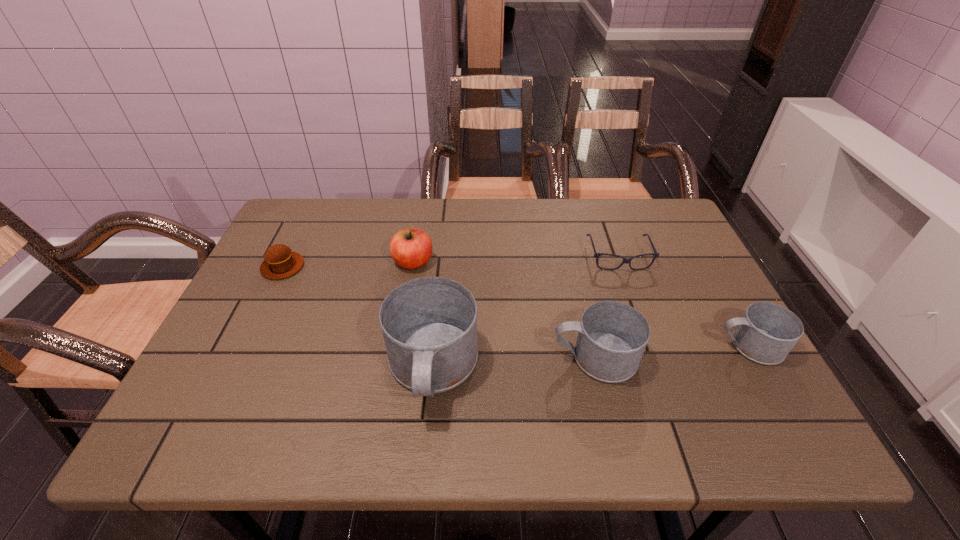
Locate an element on the screen. This screenshot has width=960, height=540. the tallest mug is located at coordinates (429, 324).

Where is `the leftmost mug`? the leftmost mug is located at coordinates (429, 324).

The height and width of the screenshot is (540, 960). Find the location of `the second mug from right to left`. the second mug from right to left is located at coordinates (612, 336).

The height and width of the screenshot is (540, 960). Find the location of `the rightmost object`. the rightmost object is located at coordinates (767, 332).

What are the coordinates of `the fourth tallest object` in the screenshot? It's located at (767, 332).

Where is `apple`? The image size is (960, 540). apple is located at coordinates (411, 248).

Identify the location of spectacles. (596, 255).

I want to click on the leftmost object, so click(x=280, y=262).

This screenshot has height=540, width=960. Find the location of `vacant region located on the side of the second mug from left to right with the handle`. vacant region located on the side of the second mug from left to right with the handle is located at coordinates (507, 357).

Locate an element on the screen. free space located 0.370m on the side of the second mug from left to right with the handle is located at coordinates (384, 357).